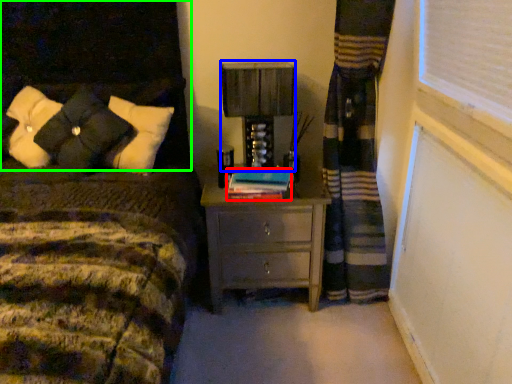
Question: Estimate the real-world distances between objects in this image. Which object is farther from book (highlighted by a red box), table lamp (highlighted by a blue box) or headboard (highlighted by a green box)?

Choices:
 (A) table lamp
 (B) headboard

Answer: (B)